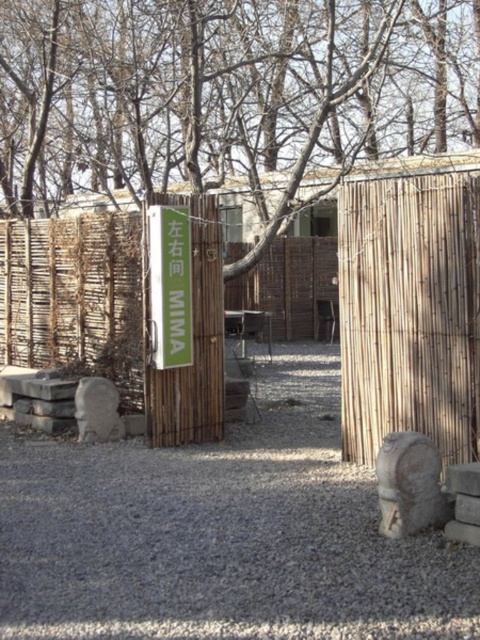
Image resolution: width=480 pixels, height=640 pixels. I want to click on gray gravel at center, so tap(216, 544).

Who is more distant from viewer, (352, 579) or (178, 212)?

Positioned behind is point (178, 212).

Does point (149, 547) come in front of point (180, 280)?

Yes, point (149, 547) is closer to viewer.

You are a GUI agent. You are given a task and a screenshot of the screen. Output one action in this format:
    pyautogui.click(x=<x>, y=<y>)
    Task: Click on the gray gravel at center
    
    Given the screenshot: What is the action you would take?
    pyautogui.click(x=216, y=544)

Is bamboo fence at center shorter than gray stone at lower right?

No.

Between bamboo fence at center and gray stone at lower right, which one has more height?

bamboo fence at center is taller.

Is point (333, 275) in front of point (377, 483)?

No, (333, 275) is further to viewer.

What are the coordinates of `bamboo fence at center` in the screenshot? It's located at (289, 285).

The image size is (480, 640). I want to click on gray gravel at center, so click(x=216, y=544).

Consider the image. Between gray gravel at center and gray stone at lower right, which one appears on the right side from the viewer's perspective?

gray stone at lower right is more to the right.

Is point (204, 632) positioned in front of point (412, 524)?

Yes.

Where is `gray gravel at center`? gray gravel at center is located at coordinates (216, 544).